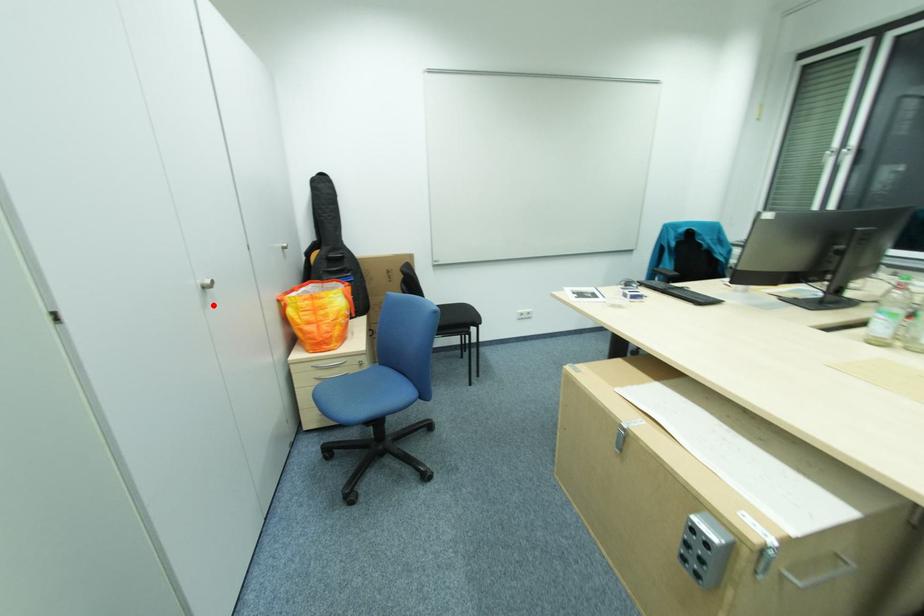
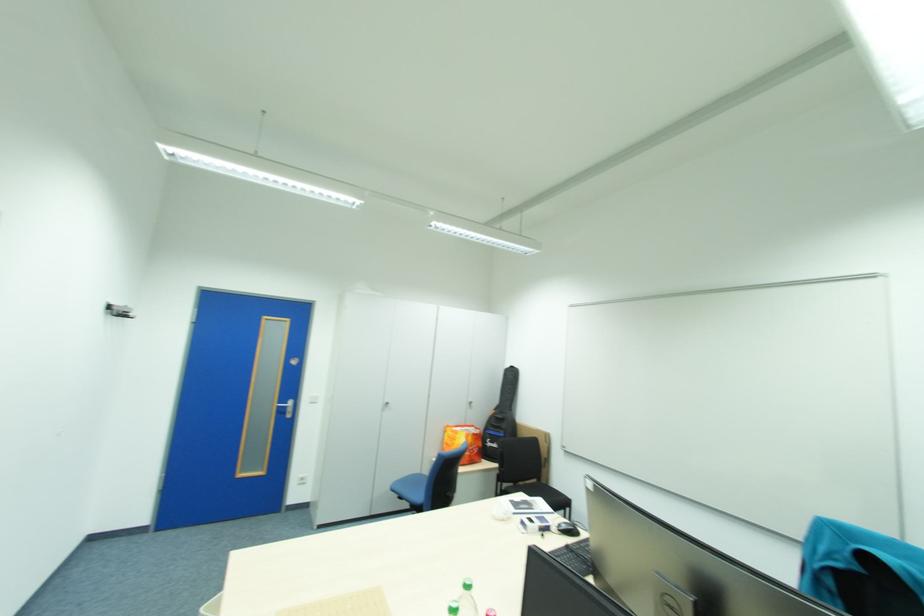
The point at the highlighted location is marked in the first image. Where is the corresponding point in the second image?

(392, 410)